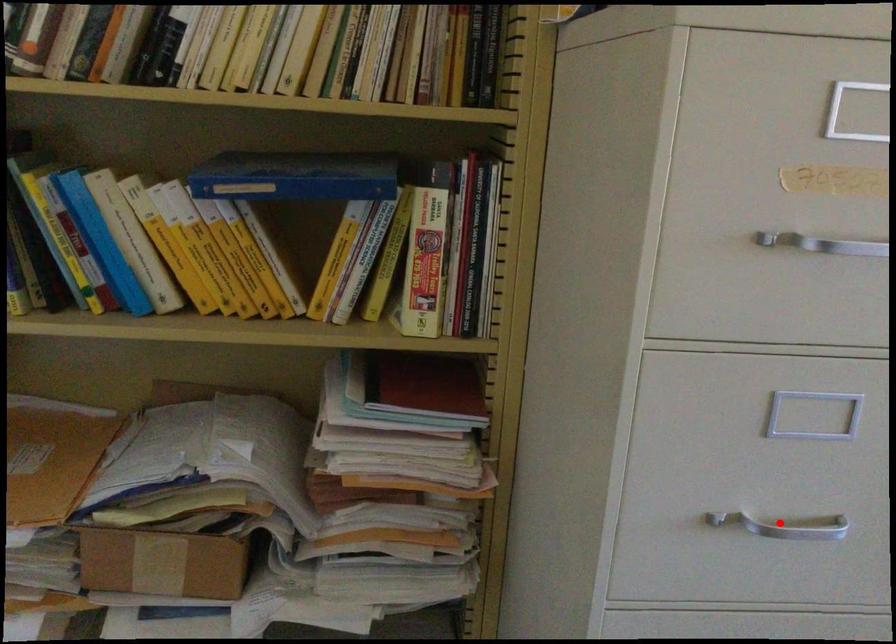
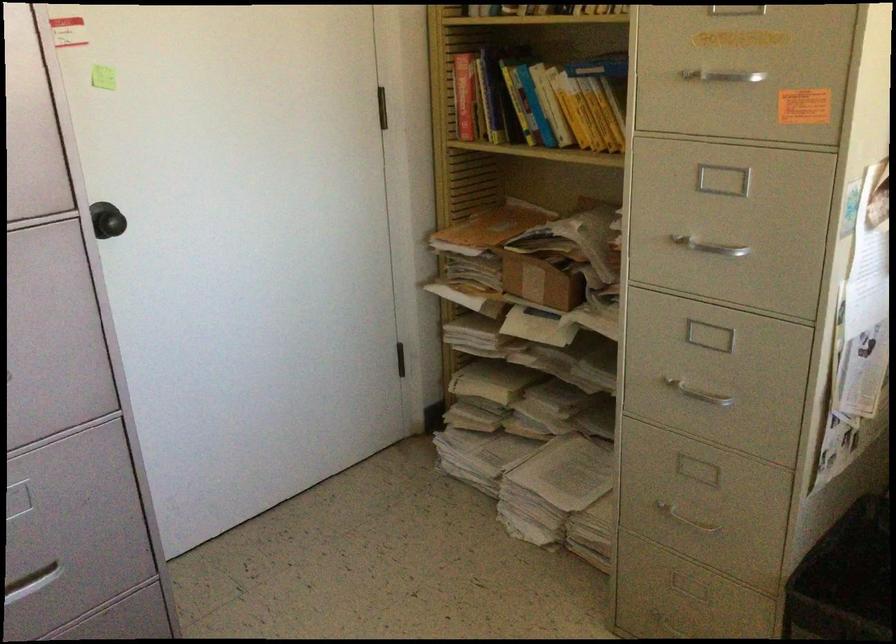
Question: I am providing you with two images of the same scene from different viewpoints. Given a red point in image1, look at the same physical point in image2. Is it:

Choices:
 (A) Closer to the viewpoint
 (B) Farther from the viewpoint

Answer: (B)